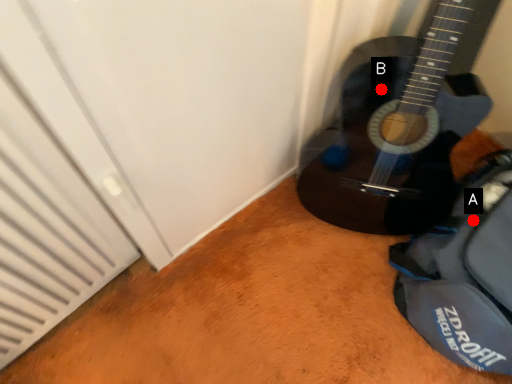
Question: Two points are circled on the image, labeled by A and B beside each circle. Which point is closer to the camera?

Choices:
 (A) A is closer
 (B) B is closer

Answer: (B)